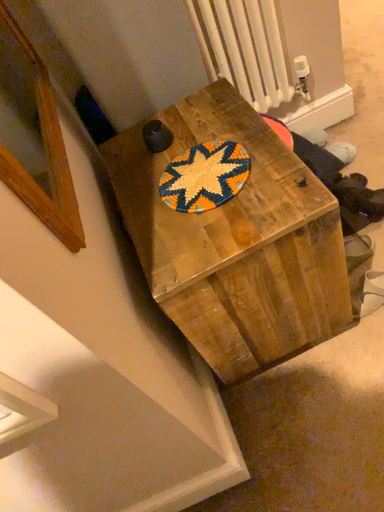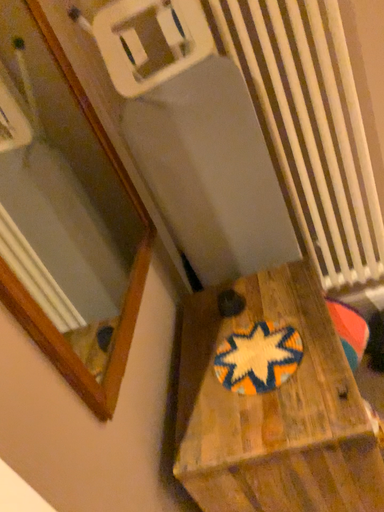
Question: Which way did the camera rotate in the video?

Choices:
 (A) rotated left
 (B) rotated right

Answer: (A)